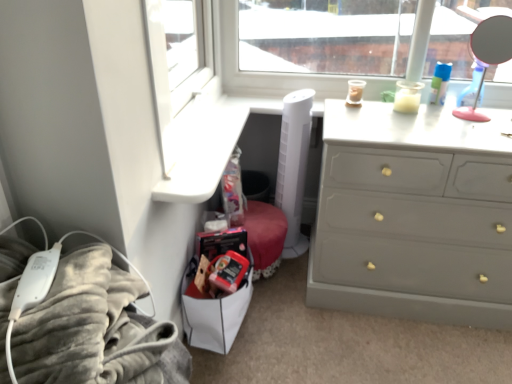
Locate an element on the screen. matte gray dresser at right is located at coordinates (413, 217).

Identify the location of velvety gray blanket at lower left. (95, 329).

Looking at the image, does matte gray dresser at right seem bigger or smaller compared to polished silver mirror at upper right?

matte gray dresser at right is bigger than polished silver mirror at upper right.

From their relative heights in the image, would you say matte gray dresser at right is taller or shorter than polished silver mirror at upper right?

Considering their sizes, matte gray dresser at right has more height than polished silver mirror at upper right.

Would you say matte gray dresser at right is a long distance from polished silver mirror at upper right?

matte gray dresser at right is positioned a significant distance from polished silver mirror at upper right.

Considering the relative sizes of velvety gray blanket at lower left and matte gray dresser at right in the image provided, is velvety gray blanket at lower left thinner than matte gray dresser at right?

Indeed, velvety gray blanket at lower left has a lesser width compared to matte gray dresser at right.

Visually, is velvety gray blanket at lower left positioned to the left or to the right of matte gray dresser at right?

In the image, velvety gray blanket at lower left appears on the left side of matte gray dresser at right.

Is matte gray dresser at right a part of velvety gray blanket at lower left?

No, matte gray dresser at right is not a part of velvety gray blanket at lower left.

From the image's perspective, is velvety gray blanket at lower left on top of matte gray dresser at right?

Actually, velvety gray blanket at lower left appears below matte gray dresser at right in the image.

How different are the orientations of velvety gray blanket at lower left and polished silver mirror at upper right in degrees?

The facing directions of velvety gray blanket at lower left and polished silver mirror at upper right are 102 degrees apart.

Which point is more forward, (167, 328) or (478, 26)?

Point (167, 328)

Considering the relative positions of velvety gray blanket at lower left and polished silver mirror at upper right in the image provided, is velvety gray blanket at lower left to the left or to the right of polished silver mirror at upper right?

Based on their positions, velvety gray blanket at lower left is located to the left of polished silver mirror at upper right.

Could you tell me if polished silver mirror at upper right is turned towards matte gray dresser at right?

No, polished silver mirror at upper right is not oriented towards matte gray dresser at right.

Is point (506, 35) more distant than point (432, 305)?

Yes.

Is polished silver mirror at upper right outside of matte gray dresser at right?

That's correct, polished silver mirror at upper right is outside of matte gray dresser at right.

Considering the sizes of objects polished silver mirror at upper right and matte gray dresser at right in the image provided, who is shorter, polished silver mirror at upper right or matte gray dresser at right?

With less height is polished silver mirror at upper right.

Based on the photo, can you confirm if polished silver mirror at upper right is bigger than velvety gray blanket at lower left?

No.

Considering the relative positions of polished silver mirror at upper right and velvety gray blanket at lower left in the image provided, is polished silver mirror at upper right behind velvety gray blanket at lower left?

Yes, the depth of polished silver mirror at upper right is greater than that of velvety gray blanket at lower left.

Would you say polished silver mirror at upper right is inside or outside velvety gray blanket at lower left?

polished silver mirror at upper right exists outside the volume of velvety gray blanket at lower left.

From the picture: Is polished silver mirror at upper right to the left or to the right of velvety gray blanket at lower left in the image?

In the image, polished silver mirror at upper right appears on the right side of velvety gray blanket at lower left.

How much distance is there between matte gray dresser at right and velvety gray blanket at lower left?

The distance of matte gray dresser at right from velvety gray blanket at lower left is 35.21 inches.

Is point (354, 178) positioned after point (188, 362)?

Yes, point (354, 178) is behind point (188, 362).

This screenshot has width=512, height=384. I want to click on chest of drawers behind the velvety gray blanket at lower left, so click(x=413, y=217).

How different are the orientations of matte gray dresser at right and velvety gray blanket at lower left in degrees?

88.4 degrees separate the facing orientations of matte gray dresser at right and velvety gray blanket at lower left.

Locate an element on the screen. mirror on the right of matte gray dresser at right is located at coordinates (492, 40).

The width and height of the screenshot is (512, 384). Identify the location of the chest of drawers above the velvety gray blanket at lower left (from the image's perspective). click(x=413, y=217).

Estimate the real-world distances between objects in this image. Which object is further from velvety gray blanket at lower left, polished silver mirror at upper right or matte gray dresser at right?

polished silver mirror at upper right is positioned further to the anchor velvety gray blanket at lower left.

From the image, which object appears to be nearer to matte gray dresser at right, velvety gray blanket at lower left or polished silver mirror at upper right?

The object closer to matte gray dresser at right is velvety gray blanket at lower left.

Considering their positions, is velvety gray blanket at lower left positioned closer to polished silver mirror at upper right than matte gray dresser at right?

The object closer to polished silver mirror at upper right is matte gray dresser at right.

Looking at the image, which one is located closer to velvety gray blanket at lower left, matte gray dresser at right or polished silver mirror at upper right?

matte gray dresser at right lies closer to velvety gray blanket at lower left than the other object.

When comparing their distances from polished silver mirror at upper right, does matte gray dresser at right or velvety gray blanket at lower left seem closer?

matte gray dresser at right is positioned closer to the anchor polished silver mirror at upper right.

Estimate the real-world distances between objects in this image. Which object is closer to matte gray dresser at right, polished silver mirror at upper right or velvety gray blanket at lower left?

velvety gray blanket at lower left.

This screenshot has width=512, height=384. I want to click on the chest of drawers situated between velvety gray blanket at lower left and polished silver mirror at upper right from left to right, so click(413, 217).